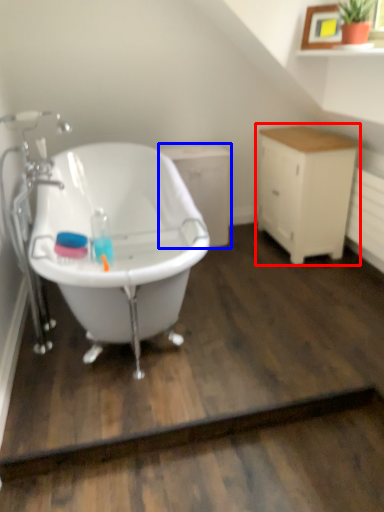
Question: Which object is closer to the camera taking this photo, cabinetry (highlighted by a red box) or cabinetry (highlighted by a blue box)?

Choices:
 (A) cabinetry
 (B) cabinetry

Answer: (A)